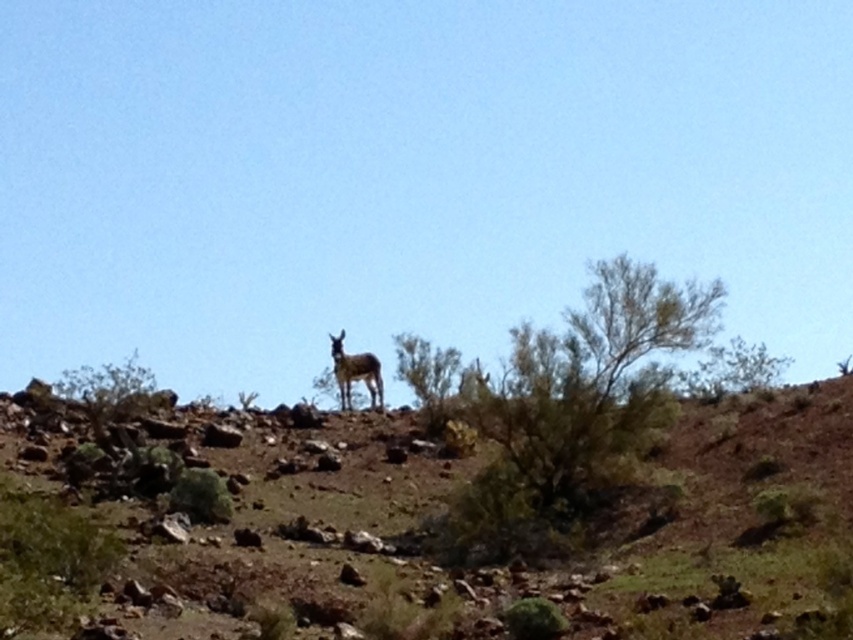
Question: Is brown rocky hillside at center smaller than brown furry deer at center?

Choices:
 (A) yes
 (B) no

Answer: (B)

Question: Does brown rocky hillside at center appear on the left side of brown furry deer at center?

Choices:
 (A) yes
 (B) no

Answer: (B)

Question: Which of the following is the farthest from the observer?

Choices:
 (A) (814, 534)
 (B) (378, 397)

Answer: (B)

Question: Can you confirm if brown rocky hillside at center is positioned to the left of brown furry deer at center?

Choices:
 (A) yes
 (B) no

Answer: (B)